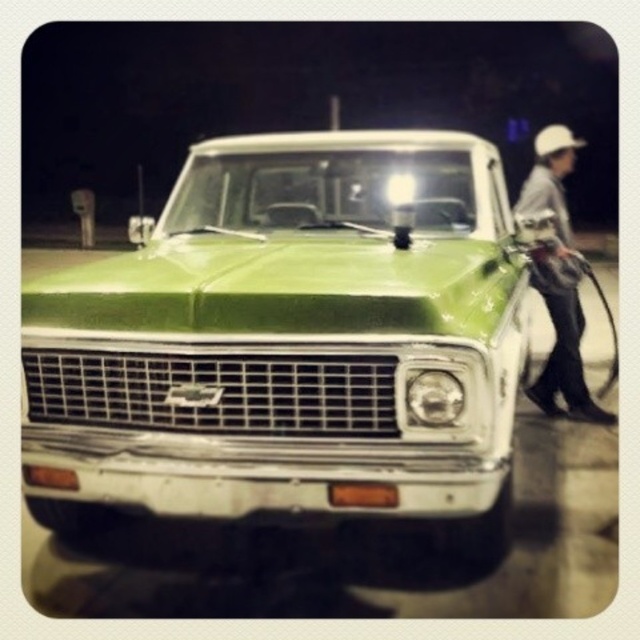
Question: Can you confirm if green glossy truck at center is positioned to the left of white hard hat at right?

Choices:
 (A) no
 (B) yes

Answer: (B)

Question: Is green glossy truck at center bigger than white hard hat at right?

Choices:
 (A) yes
 (B) no

Answer: (B)

Question: Which of the following is the farthest from the observer?

Choices:
 (A) (596, 404)
 (B) (257, 440)

Answer: (A)

Question: Which of the following is the farthest from the observer?

Choices:
 (A) white hard hat at right
 (B) green glossy truck at center

Answer: (A)

Question: Does green glossy truck at center have a larger size compared to white hard hat at right?

Choices:
 (A) yes
 (B) no

Answer: (B)

Question: Which object is farther from the camera taking this photo?

Choices:
 (A) green glossy truck at center
 (B) white hard hat at right

Answer: (B)